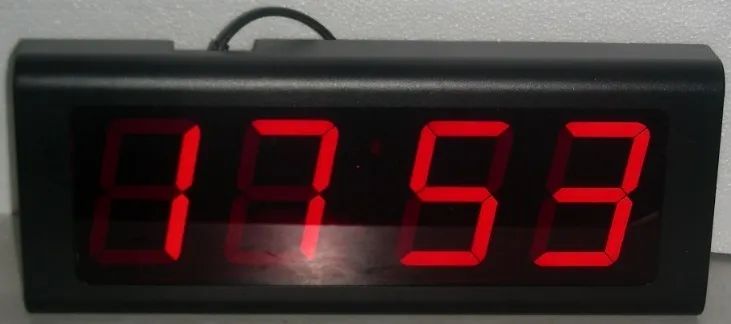
Locate an element on the screen. The height and width of the screenshot is (324, 731). wall is located at coordinates (572, 31).